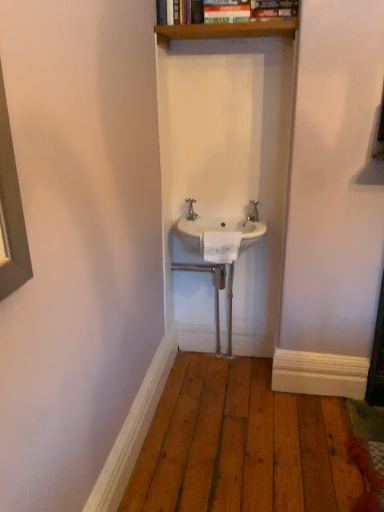
Describe the element at coordinates (191, 210) in the screenshot. This screenshot has width=384, height=512. I see `silver metallic tap at center` at that location.

The height and width of the screenshot is (512, 384). What are the coordinates of `silver metallic tap at center` in the screenshot? It's located at (191, 210).

From a real-world perspective, which is physically above, wooden shelf at upper center or white ceramic sink at center?

wooden shelf at upper center.

Based on the photo, does wooden shelf at upper center have a larger size compared to white ceramic sink at center?

Incorrect, wooden shelf at upper center is not larger than white ceramic sink at center.

Locate an element on the screen. The height and width of the screenshot is (512, 384). shelf located above the white ceramic sink at center (from the image's perspective) is located at coordinates (227, 30).

Is wooden shelf at upper center oriented away from white ceramic sink at center?

No.

Between white plastic towel bar at center and silver metallic tap at center, which one has larger size?

With larger size is white plastic towel bar at center.

Which is behind, point (236, 258) or point (193, 212)?

The point (236, 258) is behind.

From the picture: Can you confirm if white plastic towel bar at center is positioned to the left of silver metallic tap at center?

Incorrect, white plastic towel bar at center is not on the left side of silver metallic tap at center.

Is white ceramic sink at center situated inside wooden shelf at upper center or outside?

white ceramic sink at center is not enclosed by wooden shelf at upper center.

Consider the image. From the image's perspective, is white ceramic sink at center below wooden shelf at upper center?

Correct, white ceramic sink at center appears lower than wooden shelf at upper center in the image.

How much distance is there between white ceramic sink at center and wooden shelf at upper center?

They are 33.31 inches apart.

Does white ceramic sink at center appear on the right side of wooden shelf at upper center?

No, white ceramic sink at center is not to the right of wooden shelf at upper center.

Consider the image. From a real-world perspective, between silver metallic tap at center and white plastic towel bar at center, who is vertically lower?

white plastic towel bar at center is physically lower.

Does point (187, 200) appear closer or farther from the camera than point (206, 258)?

Point (187, 200) is farther from the camera than point (206, 258).

Does silver metallic tap at center have a lesser width compared to white plastic towel bar at center?

Yes, silver metallic tap at center is thinner than white plastic towel bar at center.

Is silver metallic tap at center to the left of white plastic towel bar at center from the viewer's perspective?

Yes.

Which of these two, silver metallic tap at center or wooden shelf at upper center, is thinner?

With smaller width is silver metallic tap at center.

Who is more distant, silver metallic tap at center or wooden shelf at upper center?

silver metallic tap at center is further from the camera.

Does point (190, 215) come in front of point (156, 26)?

No, (190, 215) is behind (156, 26).

What's the angular difference between white ceramic sink at center and white plastic towel bar at center's facing directions?

The angle between the facing direction of white ceramic sink at center and the facing direction of white plastic towel bar at center is 0.000143 degrees.

Is white ceramic sink at center bigger or smaller than white plastic towel bar at center?

white ceramic sink at center is bigger than white plastic towel bar at center.

Is white ceramic sink at center inside the boundaries of white plastic towel bar at center, or outside?

white ceramic sink at center is outside white plastic towel bar at center.

Who is shorter, white ceramic sink at center or white plastic towel bar at center?

white ceramic sink at center.

Is white plastic towel bar at center not within white ceramic sink at center?

white plastic towel bar at center is positioned outside white ceramic sink at center.

Which of these two, white plastic towel bar at center or white ceramic sink at center, stands taller?

Standing taller between the two is white plastic towel bar at center.

Are white plastic towel bar at center and white ceramic sink at center located far from each other?

No, white plastic towel bar at center is not far from white ceramic sink at center.

Does white plastic towel bar at center appear on the left side of white ceramic sink at center?

Indeed, white plastic towel bar at center is positioned on the left side of white ceramic sink at center.

What are the coordinates of `shelf above the white ceramic sink at center (from a real-world perspective)` in the screenshot? It's located at (227, 30).

Locate an element on the screen. Image resolution: width=384 pixels, height=512 pixels. tap above the white plastic towel bar at center (from the image's perspective) is located at coordinates (191, 210).

Looking at the image, which one is located further to wooden shelf at upper center, white ceramic sink at center or white plastic towel bar at center?

white plastic towel bar at center lies further to wooden shelf at upper center than the other object.

Considering their positions, is white plastic towel bar at center positioned further to wooden shelf at upper center than silver metallic tap at center?

white plastic towel bar at center is positioned further to the anchor wooden shelf at upper center.

Looking at the image, which one is located closer to white plastic towel bar at center, wooden shelf at upper center or white ceramic sink at center?

The object closer to white plastic towel bar at center is white ceramic sink at center.

Looking at the image, which one is located further to silver metallic tap at center, white ceramic sink at center or wooden shelf at upper center?

wooden shelf at upper center lies further to silver metallic tap at center than the other object.

Looking at this image, looking at the image, which one is located closer to white ceramic sink at center, silver metallic tap at center or white plastic towel bar at center?

Among the two, white plastic towel bar at center is located nearer to white ceramic sink at center.

Which object lies further to the anchor point white plastic towel bar at center, wooden shelf at upper center or silver metallic tap at center?

wooden shelf at upper center is further to white plastic towel bar at center.

Based on their spatial positions, is white ceramic sink at center or white plastic towel bar at center closer to silver metallic tap at center?

white ceramic sink at center is positioned closer to the anchor silver metallic tap at center.

In the scene shown: Based on their spatial positions, is white plastic towel bar at center or white ceramic sink at center further from silver metallic tap at center?

Based on the image, white plastic towel bar at center appears to be further to silver metallic tap at center.

This screenshot has width=384, height=512. Find the location of `sink between white plastic towel bar at center and silver metallic tap at center in the front-back direction`. sink between white plastic towel bar at center and silver metallic tap at center in the front-back direction is located at coordinates (219, 234).

This screenshot has height=512, width=384. Find the location of `sink between wooden shelf at upper center and white plastic towel bar at center in the up-down direction`. sink between wooden shelf at upper center and white plastic towel bar at center in the up-down direction is located at coordinates (219, 234).

Locate an element on the screen. tap that lies between wooden shelf at upper center and white plastic towel bar at center from top to bottom is located at coordinates (191, 210).

At what (x,y) coordinates should I click in order to perform the action: click on tap that lies between wooden shelf at upper center and white ceramic sink at center from top to bottom. Please return your answer as a coordinate pair (x, y). Looking at the image, I should click on (191, 210).